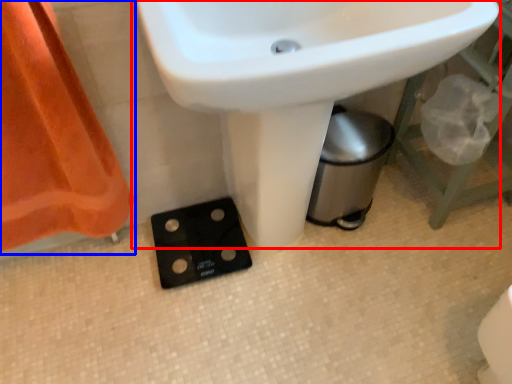
Question: Which object is closer to the camera taking this photo, sink (highlighted by a red box) or curtain (highlighted by a blue box)?

Choices:
 (A) sink
 (B) curtain

Answer: (A)